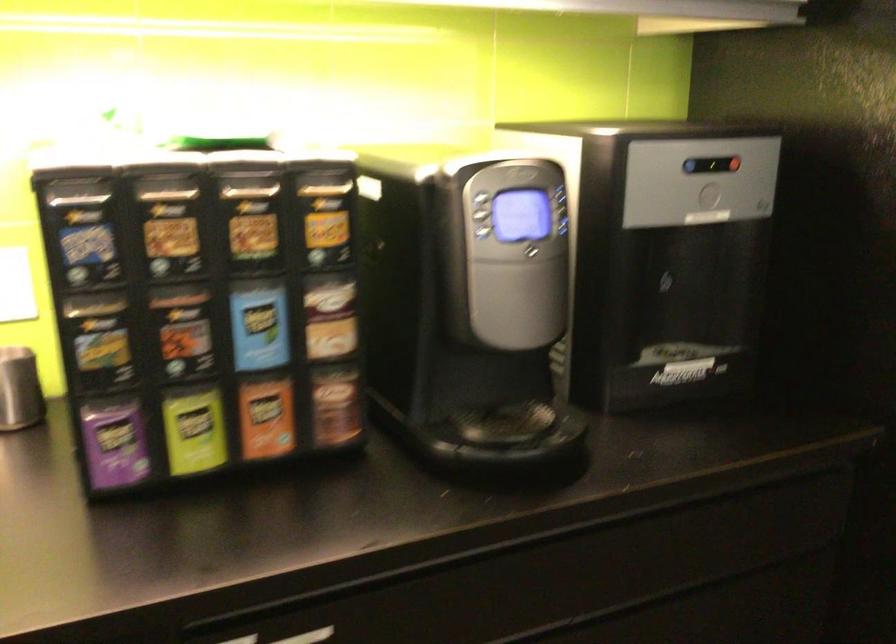
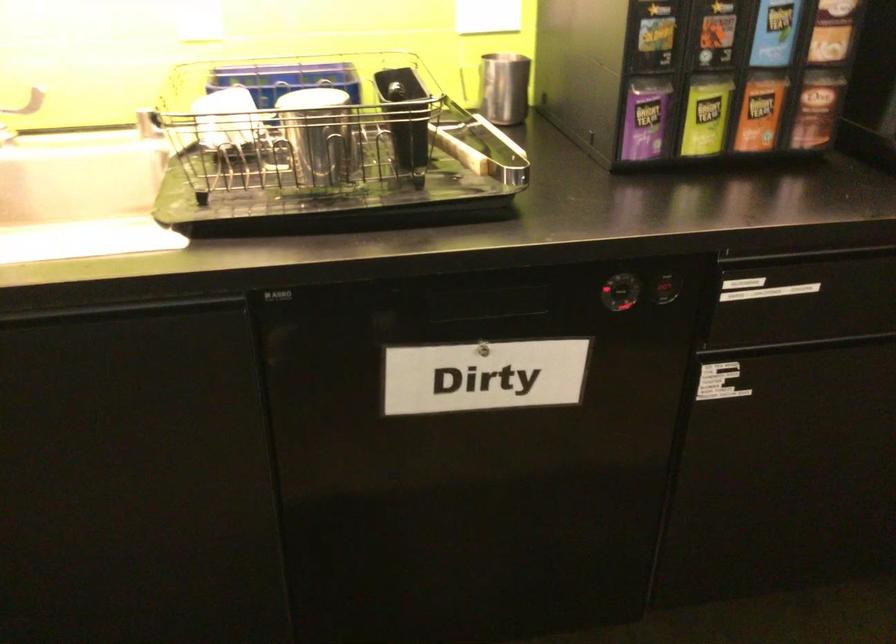
The point at (263, 417) is marked in the first image. Where is the corresponding point in the second image?

(760, 111)